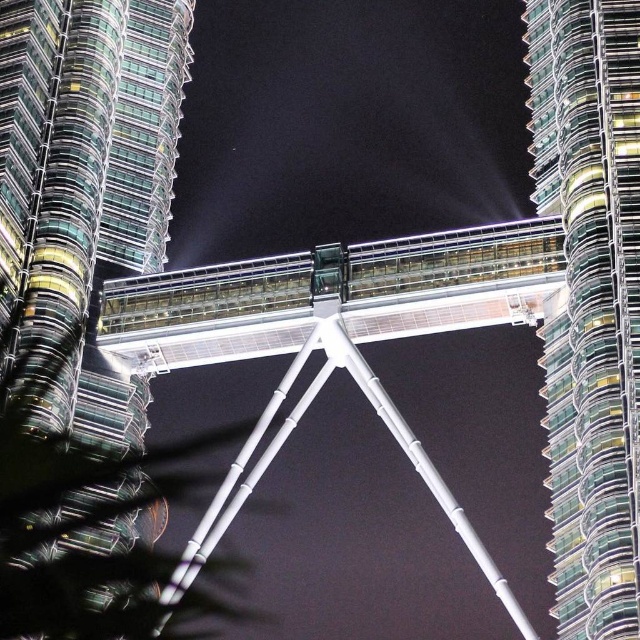
Which is above, glassy steel skyscraper at center or white metallic suspension bridge at center?

glassy steel skyscraper at center

Does glassy steel skyscraper at center have a smaller size compared to white metallic suspension bridge at center?

Yes, glassy steel skyscraper at center is smaller than white metallic suspension bridge at center.

Which is in front, point (572, 291) or point (308, 396)?

Point (572, 291)

This screenshot has height=640, width=640. Identify the location of glassy steel skyscraper at center. (592, 301).

Can you confirm if transparent glass tower at center is positioned to the left of white metallic suspension bridge at center?

Indeed, transparent glass tower at center is positioned on the left side of white metallic suspension bridge at center.

The image size is (640, 640). What do you see at coordinates (86, 184) in the screenshot?
I see `transparent glass tower at center` at bounding box center [86, 184].

Find the location of a particular element. transparent glass tower at center is located at coordinates (86, 184).

What do you see at coordinates (86, 184) in the screenshot? This screenshot has width=640, height=640. I see `transparent glass tower at center` at bounding box center [86, 184].

Can you confirm if transparent glass tower at center is positioned to the right of glassy steel skyscraper at center?

Incorrect, transparent glass tower at center is not on the right side of glassy steel skyscraper at center.

Is point (0, 68) farther from viewer compared to point (561, 435)?

Yes.

At what (x,y) coordinates should I click in order to perform the action: click on transparent glass tower at center. Please return your answer as a coordinate pair (x, y). Image resolution: width=640 pixels, height=640 pixels. Looking at the image, I should click on (86, 184).